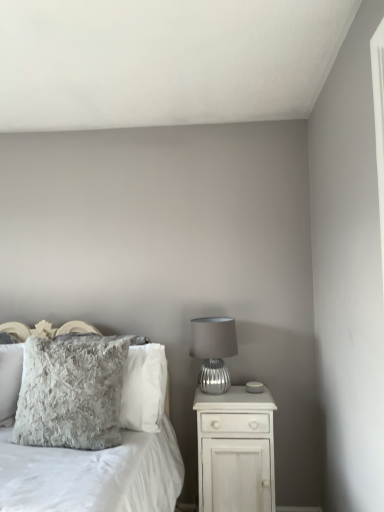
Question: Considering the relative sizes of fuzzy gray pillow at center-left, positioned as the 2th pillow in front-to-back order, and white wood nightstand at right in the image provided, is fuzzy gray pillow at center-left, positioned as the 2th pillow in front-to-back order, bigger than white wood nightstand at right?

Choices:
 (A) yes
 (B) no

Answer: (B)

Question: Is fuzzy gray pillow at center-left, the first pillow from the back, further to camera compared to white wood nightstand at right?

Choices:
 (A) yes
 (B) no

Answer: (B)

Question: Is fuzzy gray pillow at center-left, the first pillow from the back, turned away from white wood nightstand at right?

Choices:
 (A) yes
 (B) no

Answer: (B)

Question: Does fuzzy gray pillow at center-left, the first pillow from the back, have a greater height compared to white wood nightstand at right?

Choices:
 (A) no
 (B) yes

Answer: (A)

Question: From a real-world perspective, is fuzzy gray pillow at center-left, the first pillow from the back, below white wood nightstand at right?

Choices:
 (A) no
 (B) yes

Answer: (A)

Question: From the image's perspective, is fuzzy gray pillow at center-left, the first pillow from the back, located beneath white wood nightstand at right?

Choices:
 (A) no
 (B) yes

Answer: (A)

Question: Considering the relative sizes of fuzzy gray pillow at center-left, the first pillow from the back, and fuzzy gray pillow at left, the 2th pillow positioned from the back, in the image provided, is fuzzy gray pillow at center-left, the first pillow from the back, wider than fuzzy gray pillow at left, the 2th pillow positioned from the back,?

Choices:
 (A) yes
 (B) no

Answer: (B)

Question: Can you confirm if fuzzy gray pillow at center-left, positioned as the 2th pillow in front-to-back order, is smaller than fuzzy gray pillow at left, which is counted as the 1th pillow, starting from the front?

Choices:
 (A) no
 (B) yes

Answer: (B)

Question: Does fuzzy gray pillow at center-left, the first pillow from the back, have a greater height compared to fuzzy gray pillow at left, which is counted as the 1th pillow, starting from the front?

Choices:
 (A) no
 (B) yes

Answer: (A)

Question: Is fuzzy gray pillow at left, which is counted as the 1th pillow, starting from the front, at the back of fuzzy gray pillow at center-left, positioned as the 2th pillow in front-to-back order?

Choices:
 (A) yes
 (B) no

Answer: (A)

Question: From the image's perspective, does fuzzy gray pillow at center-left, the first pillow from the back, appear lower than fuzzy gray pillow at left, which is counted as the 1th pillow, starting from the front?

Choices:
 (A) no
 (B) yes

Answer: (B)

Question: From a real-world perspective, is fuzzy gray pillow at center-left, the first pillow from the back, located higher than fuzzy gray pillow at left, which is counted as the 1th pillow, starting from the front?

Choices:
 (A) no
 (B) yes

Answer: (A)

Question: From a real-world perspective, is white wood nightstand at right located beneath silver textured lamp at right?

Choices:
 (A) yes
 (B) no

Answer: (A)